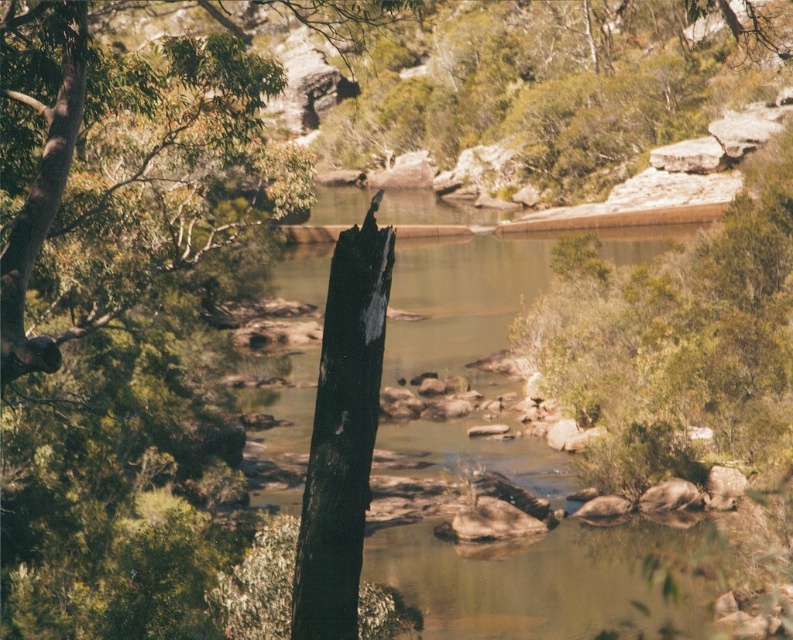
Question: Among these objects, which one is farthest from the camera?

Choices:
 (A) green leafy tree at left
 (B) clear water at center

Answer: (B)

Question: Which of the following is the farthest from the observer?

Choices:
 (A) green leafy tree at left
 (B) clear water at center

Answer: (B)

Question: Is clear water at center closer to camera compared to green leafy tree at left?

Choices:
 (A) yes
 (B) no

Answer: (B)

Question: Does clear water at center appear over green leafy tree at left?

Choices:
 (A) no
 (B) yes

Answer: (A)

Question: Can you confirm if clear water at center is wider than green leafy tree at left?

Choices:
 (A) no
 (B) yes

Answer: (B)